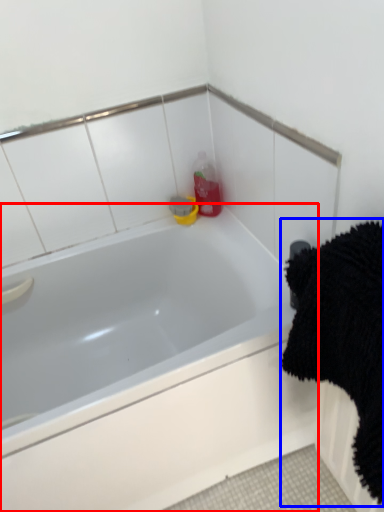
Question: Which object appears closest to the camera in this image, bathtub (highlighted by a red box) or bath towel (highlighted by a blue box)?

Choices:
 (A) bathtub
 (B) bath towel

Answer: (B)